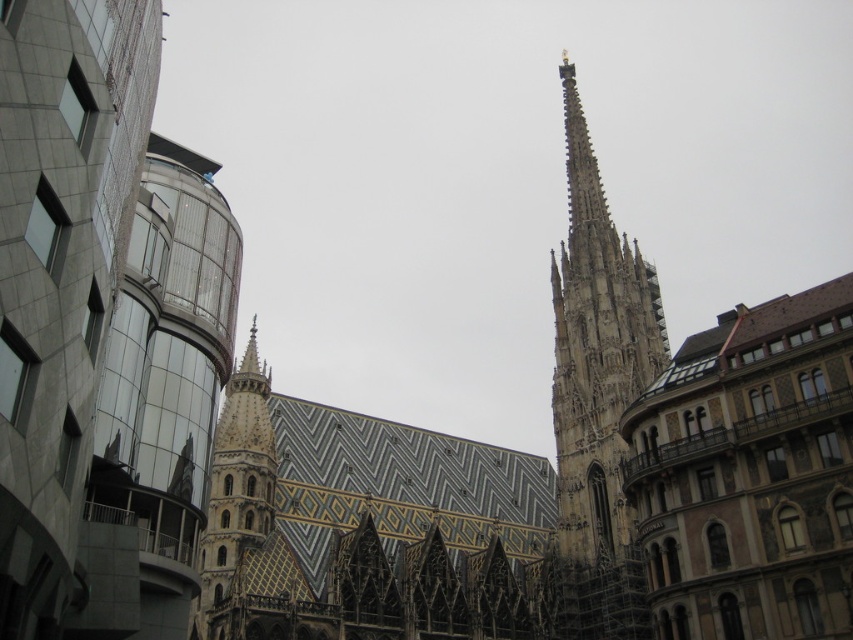
Who is taller, stone spire at upper right or golden mosaic tower at center?

Standing taller between the two is stone spire at upper right.

Is point (579, 438) closer to camera compared to point (239, 442)?

No, it is behind (239, 442).

The image size is (853, 640). Identify the location of stone spire at upper right. (596, 397).